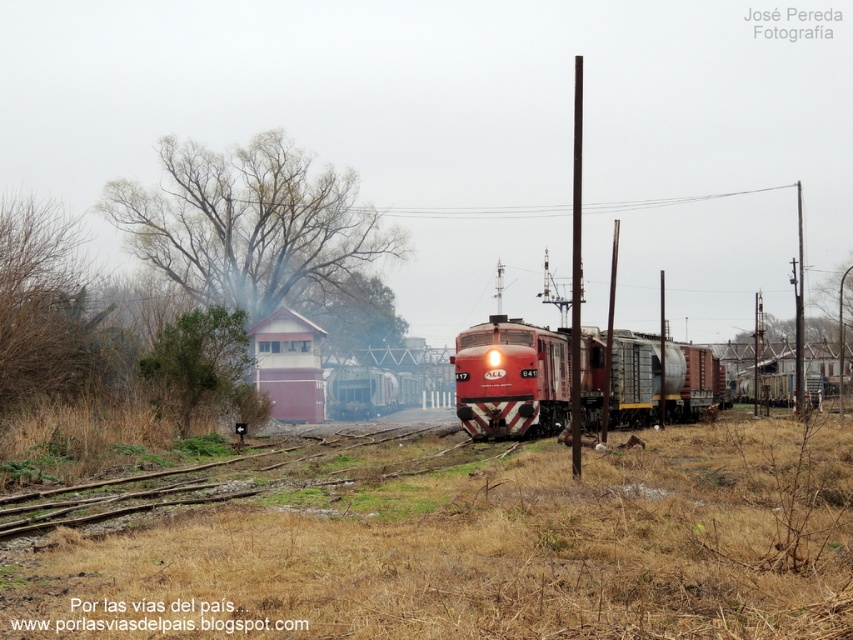
Based on the photo, you are a photographer trying to capture the matte red train at center and the wooden track at lower left in a single shot. Based on their sizes, which object will appear bigger in your photo?

The matte red train at center will appear bigger in the photo since its width is larger than that of the wooden track at lower left.

You are a railway inspector checking the tracks. You see the matte red train at center and the wooden track at lower left. Which object is closer to you?

The matte red train at center is closer to you because the wooden track at lower left is behind it.